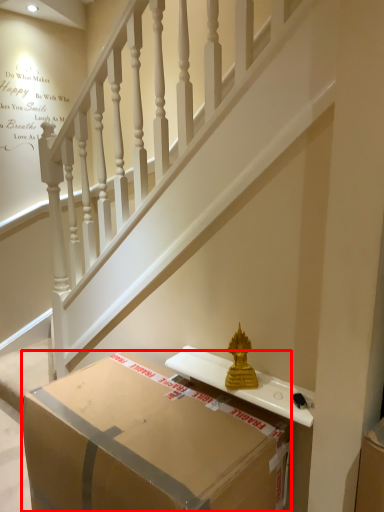
Question: In this image, where is box (annotated by the red box) located relative to stairs?

Choices:
 (A) right
 (B) left

Answer: (B)